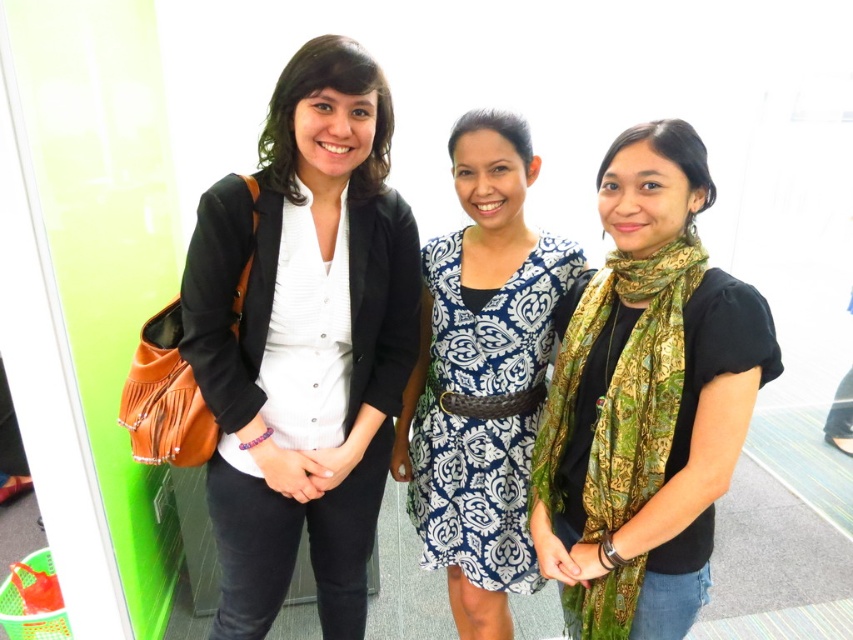
Does matte black blazer at center have a smaller size compared to green silk scarf at center?

Incorrect, matte black blazer at center is not smaller in size than green silk scarf at center.

Between point (216, 317) and point (666, 442), which one is positioned in front?

Point (666, 442) is more forward.

This screenshot has width=853, height=640. What do you see at coordinates (305, 340) in the screenshot?
I see `matte black blazer at center` at bounding box center [305, 340].

You are a GUI agent. You are given a task and a screenshot of the screen. Output one action in this format:
    pyautogui.click(x=<x>, y=<y>)
    Task: Click on the matte black blazer at center
    
    Given the screenshot: What is the action you would take?
    pyautogui.click(x=305, y=340)

Who is positioned more to the right, blue printed fabric dress at center or green silk scarf at center?

Positioned to the right is green silk scarf at center.

Does blue printed fabric dress at center appear under green silk scarf at center?

Incorrect, blue printed fabric dress at center is not positioned below green silk scarf at center.

Does point (563, 292) lie in front of point (660, 435)?

No, it is not.

Locate an element on the screen. This screenshot has height=640, width=853. blue printed fabric dress at center is located at coordinates (483, 412).

Does point (270, 221) come farther from viewer compared to point (469, 436)?

No, (270, 221) is in front of (469, 436).

Between point (350, 451) and point (544, 358), which one is positioned in front?

Point (350, 451) is in front.

Between point (329, 621) and point (469, 497), which one is positioned behind?

The point (329, 621) is behind.

Find the location of `matte black blazer at center`. matte black blazer at center is located at coordinates (305, 340).